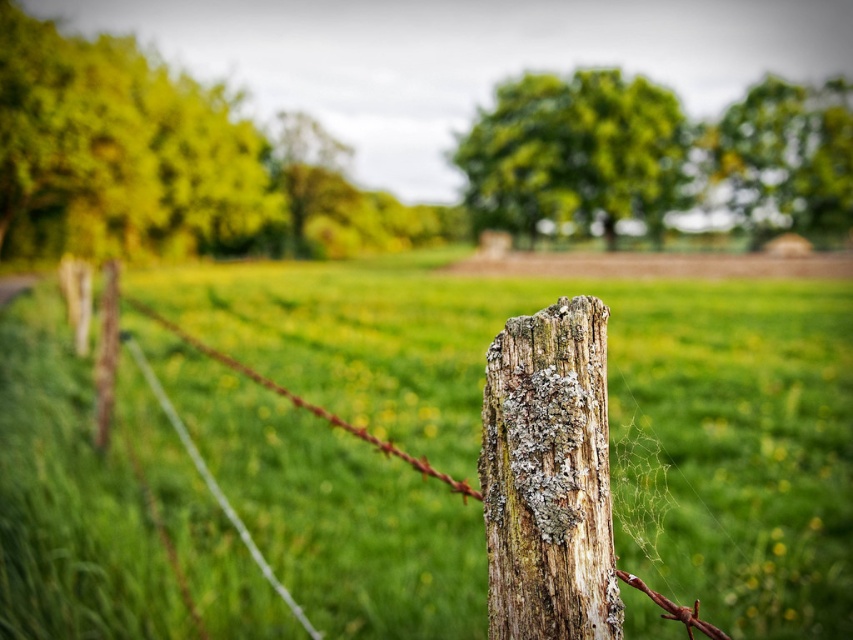
This screenshot has height=640, width=853. What do you see at coordinates (548, 476) in the screenshot? I see `weathered wood post at center` at bounding box center [548, 476].

Does weathered wood post at center have a greater height compared to green leafy tree at center?

In fact, weathered wood post at center may be shorter than green leafy tree at center.

Is point (582, 518) positioned before point (567, 83)?

Yes, point (582, 518) is in front of point (567, 83).

You are a GUI agent. You are given a task and a screenshot of the screen. Output one action in this format:
    pyautogui.click(x=<x>, y=<y>)
    Task: Click on the weathered wood post at center
    
    Given the screenshot: What is the action you would take?
    point(548,476)

Who is higher up, weathered wood post at center or silver wire at center?

weathered wood post at center is above.

Between weathered wood post at center and silver wire at center, which one appears on the left side from the viewer's perspective?

silver wire at center

I want to click on weathered wood post at center, so click(548, 476).

In order to click on weathered wood post at center in this screenshot , I will do `click(548, 476)`.

Is point (840, 330) closer to camera compared to point (202, 157)?

Yes, point (840, 330) is closer to viewer.

Between point (798, 381) and point (142, 200), which one is positioned in front?

Point (798, 381)

At what (x,y) coordinates should I click in order to perform the action: click on green grassy field at center. Please return your answer as a coordinate pair (x, y). The image size is (853, 640). Looking at the image, I should click on (608, 401).